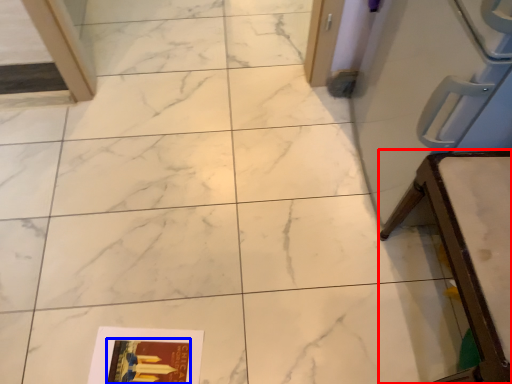
Question: Which of the following is the farthest to the observer, furniture (highlighted by a red box) or magazine (highlighted by a blue box)?

Choices:
 (A) furniture
 (B) magazine

Answer: (B)